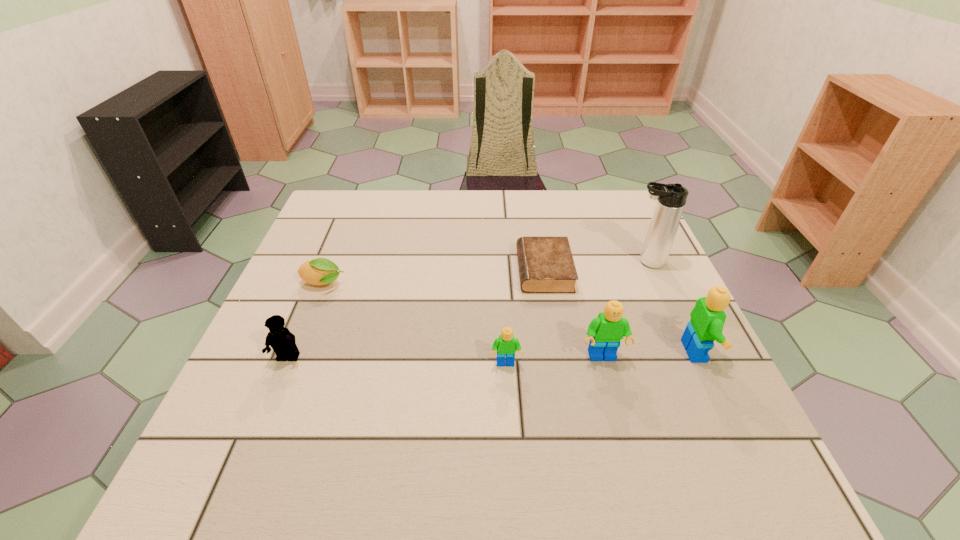
Find the location of `free space between the tallest object and the second tallest Lego`. free space between the tallest object and the second tallest Lego is located at coordinates (624, 309).

At what (x,y) coordinates should I click in order to perform the action: click on free point between the tallest object and the shortest object. Please return your answer as a coordinate pair (x, y). Image resolution: width=960 pixels, height=540 pixels. Looking at the image, I should click on (595, 266).

Identify the location of free spot between the shortest object and the tallest object. (595, 266).

Locate an element on the screen. This screenshot has width=960, height=540. empty space that is in between the third tallest object and the leftmost Lego is located at coordinates (445, 357).

This screenshot has height=540, width=960. I want to click on blank region between the thermos bottle and the second tallest Lego, so click(624, 309).

Identify the location of vacant region between the lemon and the second Lego from left to right. The image size is (960, 540). (415, 324).

Find the location of a particular element. Image resolution: width=960 pixels, height=540 pixels. the second closest object relative to the second tallest Lego is located at coordinates (707, 320).

Identify which object is located as the second nearest to the third object from left to right. Please provide its 2D coordinates. Your answer should be formatted as a tuple, i.e. [(x, y)], where the tuple contains the x and y coordinates of a point satisfying the conditions above.

[(546, 265)]

Identify which Lego is the second closest to the rightmost Lego. Please provide its 2D coordinates. Your answer should be formatted as a tuple, i.e. [(x, y)], where the tuple contains the x and y coordinates of a point satisfying the conditions above.

[(506, 345)]

Image resolution: width=960 pixels, height=540 pixels. Identify the location of Lego that can be found as the fourth closest to the second shortest object. (707, 320).